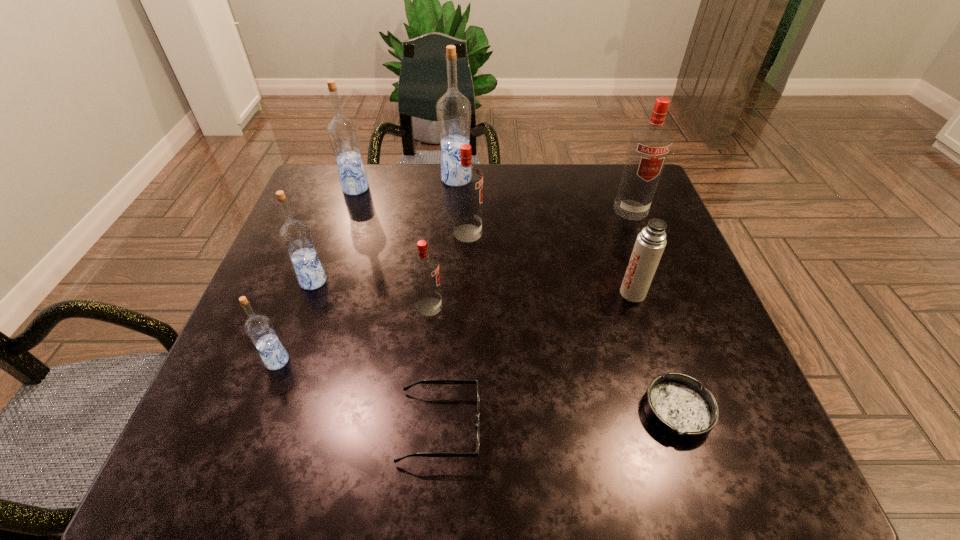
In order to click on the nearest red vodka in this screenshot , I will do `click(424, 266)`.

This screenshot has height=540, width=960. Identify the location of the smallest red vodka. (424, 266).

The image size is (960, 540). I want to click on the smallest blue vodka, so click(x=259, y=329).

Locate an element on the screen. Image resolution: width=960 pixels, height=540 pixels. the nearest vodka is located at coordinates (259, 329).

Locate an element on the screen. The height and width of the screenshot is (540, 960). the ninth tallest object is located at coordinates (441, 382).

You are a GUI agent. You are given a task and a screenshot of the screen. Output one action in this format:
    pyautogui.click(x=<x>, y=<y>)
    Task: Click on the sunglasses
    Image resolution: width=960 pixels, height=540 pixels.
    Given the screenshot: What is the action you would take?
    pyautogui.click(x=441, y=382)

Identify the location of dark ashtray. This screenshot has width=960, height=540. (676, 404).

Where is `the shortest object`? The image size is (960, 540). the shortest object is located at coordinates (676, 404).

Find the location of a particular element. The width and height of the screenshot is (960, 540). vacant space situated 0.300m on the right of the tallest object is located at coordinates (577, 179).

Image resolution: width=960 pixels, height=540 pixels. I want to click on vacant space located on the front of the second biggest blue vodka, so click(333, 256).